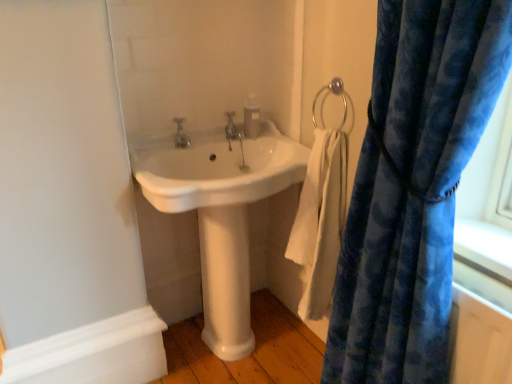
Question: Is translucent plastic soap dispenser at upper center bigger or smaller than white cotton towel at lower right?

Choices:
 (A) small
 (B) big

Answer: (A)

Question: In the image, is translucent plastic soap dispenser at upper center on the left side or the right side of white cotton towel at lower right?

Choices:
 (A) left
 (B) right

Answer: (A)

Question: Estimate the real-world distances between objects in this image. Which object is farther from the translucent plastic soap dispenser at upper center?

Choices:
 (A) velvety blue curtain at right
 (B) polished chrome faucet at center, the first tap from the right
 (C) white cotton towel at lower right
 (D) white glossy pedestal at center
 (E) silver metallic towel ring at upper right

Answer: (A)

Question: Which object is the closest to the translucent plastic soap dispenser at upper center?

Choices:
 (A) velvety blue curtain at right
 (B) silver metallic towel ring at upper right
 (C) matte silver faucet at center, which is the second tap from right to left
 (D) polished chrome faucet at center, the first tap from the right
 (E) white cotton towel at lower right

Answer: (D)